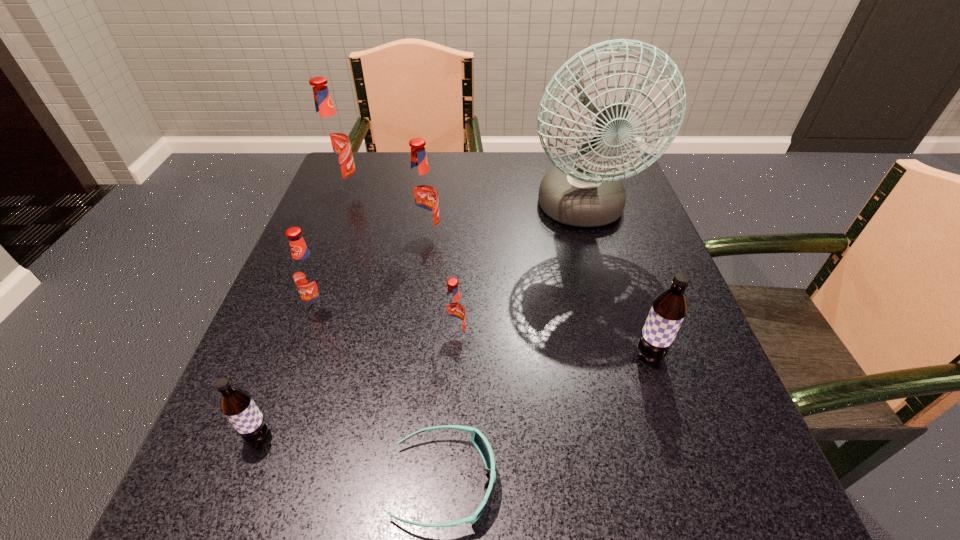
The height and width of the screenshot is (540, 960). Find the location of `free point between the farthest root beer and the tallest object`. free point between the farthest root beer and the tallest object is located at coordinates (463, 201).

The width and height of the screenshot is (960, 540). I want to click on free space between the shortest object and the fourth nearest root beer, so click(x=382, y=395).

This screenshot has width=960, height=540. What are the coordinates of `free space between the nearest red root beer and the sixth shortest object` in the screenshot? It's located at (442, 287).

Locate an element on the screen. Image resolution: width=960 pixels, height=540 pixels. vacant space that is in between the farther brown root beer and the tallest object is located at coordinates (615, 284).

Find the location of a particular element. The height and width of the screenshot is (540, 960). vacant area that lies between the cyan sunglasses and the second smallest red root beer is located at coordinates (382, 395).

You are a GUI agent. You are given a task and a screenshot of the screen. Output one action in this format:
    pyautogui.click(x=<x>, y=<y>)
    Task: Click on the vacant area between the third red root beer from left to right and the shortest object
    
    Given the screenshot: What is the action you would take?
    pyautogui.click(x=436, y=359)

Where is `object identified as the seventh closest to the right brown root beer`? object identified as the seventh closest to the right brown root beer is located at coordinates (332, 141).

Locate an element on the screen. The width and height of the screenshot is (960, 540). object identified as the fourth closest to the rightmost root beer is located at coordinates (422, 194).

Locate which root beer ranks fifth in proximity to the biggest red root beer. Please provide its 2D coordinates. Your answer should be formatted as a tuple, i.e. [(x, y)], where the tuple contains the x and y coordinates of a point satisfying the conditions above.

[(669, 308)]

Choose which root beer is the fifth nearest neighbor to the smaller brown root beer. Please provide its 2D coordinates. Your answer should be formatted as a tuple, i.e. [(x, y)], where the tuple contains the x and y coordinates of a point satisfying the conditions above.

[(332, 141)]